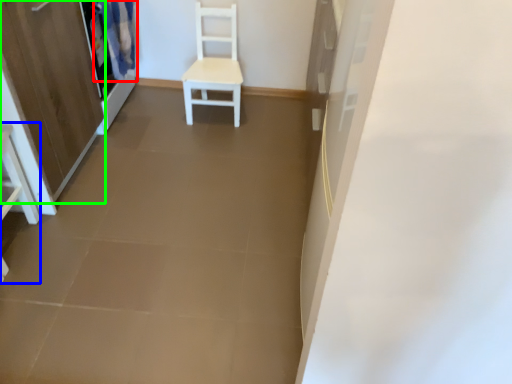
Question: Estimate the real-world distances between objects in this image. Which object is farther from curtain (highlighted by a red box), vanity (highlighted by a blue box) or screen door (highlighted by a green box)?

Choices:
 (A) vanity
 (B) screen door

Answer: (A)